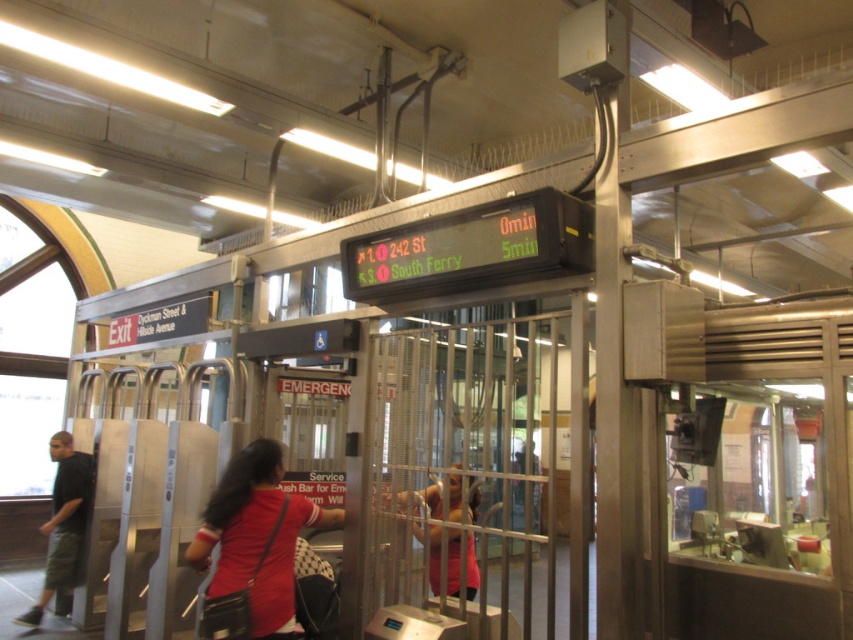
Which is below, red fabric shirt at center or pink fabric dress at center?

pink fabric dress at center is lower down.

Does red fabric shirt at center have a greater width compared to pink fabric dress at center?

Correct, the width of red fabric shirt at center exceeds that of pink fabric dress at center.

Which is in front, point (256, 452) or point (473, 545)?

Point (256, 452)

This screenshot has height=640, width=853. I want to click on red fabric shirt at center, so click(254, 541).

Who is positioned more to the left, matte black shirt at left or pink fabric dress at center?

From the viewer's perspective, matte black shirt at left appears more on the left side.

Can you confirm if matte black shirt at left is positioned to the left of pink fabric dress at center?

Correct, you'll find matte black shirt at left to the left of pink fabric dress at center.

Is point (59, 536) positioned in front of point (399, 509)?

No, (59, 536) is further to viewer.

Locate an element on the screen. This screenshot has height=640, width=853. matte black shirt at left is located at coordinates (62, 528).

Is point (264, 472) farther from camera compared to point (50, 536)?

No, it is not.

Which of these two, red fabric shirt at center or matte black shirt at left, stands shorter?

red fabric shirt at center is shorter.

Find the location of `red fabric shirt at center`. red fabric shirt at center is located at coordinates (254, 541).